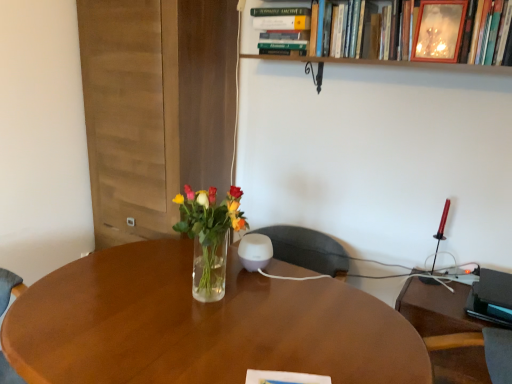
Question: Is translucent glass vase at center at the right side of wooden picture frame at upper right?

Choices:
 (A) no
 (B) yes

Answer: (A)

Question: Does translucent glass vase at center have a lesser width compared to wooden picture frame at upper right?

Choices:
 (A) yes
 (B) no

Answer: (B)

Question: Does translucent glass vase at center lie in front of wooden picture frame at upper right?

Choices:
 (A) yes
 (B) no

Answer: (A)

Question: Does translucent glass vase at center lie behind wooden picture frame at upper right?

Choices:
 (A) yes
 (B) no

Answer: (B)

Question: Can you confirm if translucent glass vase at center is taller than wooden picture frame at upper right?

Choices:
 (A) yes
 (B) no

Answer: (A)

Question: Based on their positions, is hardcover book at upper center, the second book when ordered from right to left, located to the left or right of wooden frame at upper center, the second book from the left?

Choices:
 (A) right
 (B) left

Answer: (B)

Question: Considering their positions, is hardcover book at upper center, the second book when ordered from right to left, located in front of or behind wooden frame at upper center, the second book from the left?

Choices:
 (A) front
 (B) behind

Answer: (B)

Question: Considering the positions of hardcover book at upper center, acting as the 1th book starting from the left, and wooden frame at upper center, the first book positioned from the right, in the image, is hardcover book at upper center, acting as the 1th book starting from the left, wider or thinner than wooden frame at upper center, the first book positioned from the right,?

Choices:
 (A) thin
 (B) wide

Answer: (B)

Question: From the image's perspective, is hardcover book at upper center, acting as the 1th book starting from the left, located above or below wooden frame at upper center, the second book from the left?

Choices:
 (A) below
 (B) above

Answer: (B)

Question: Looking at the image, does translucent glass vase at center seem bigger or smaller compared to wooden picture frame at upper right?

Choices:
 (A) big
 (B) small

Answer: (A)

Question: Is translucent glass vase at center in front of or behind wooden picture frame at upper right in the image?

Choices:
 (A) front
 (B) behind

Answer: (A)

Question: From a real-world perspective, relative to wooden picture frame at upper right, is translucent glass vase at center vertically above or below?

Choices:
 (A) above
 (B) below

Answer: (B)

Question: Looking at their shapes, would you say translucent glass vase at center is wider or thinner than wooden picture frame at upper right?

Choices:
 (A) wide
 (B) thin

Answer: (A)

Question: Considering the positions of black plastic computer desk at right and wooden picture frame at upper right in the image, is black plastic computer desk at right taller or shorter than wooden picture frame at upper right?

Choices:
 (A) tall
 (B) short

Answer: (A)

Question: From the image's perspective, is black plastic computer desk at right above or below wooden picture frame at upper right?

Choices:
 (A) below
 (B) above

Answer: (A)